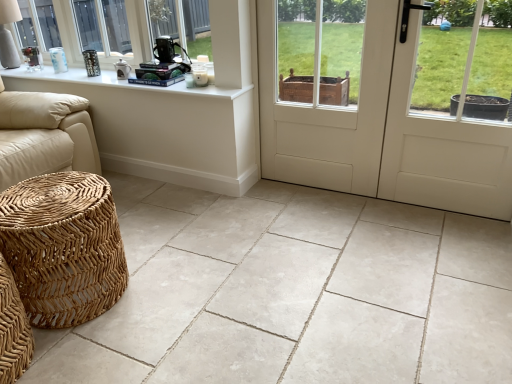
This screenshot has width=512, height=384. Find the location of `free space above woven natural basket at lower left (from a real-world perspective)`. free space above woven natural basket at lower left (from a real-world perspective) is located at coordinates [51, 197].